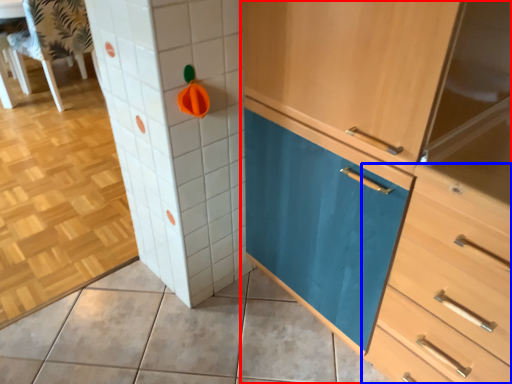
Question: Which point is further to the camera, cabinetry (highlighted by a red box) or chest of drawers (highlighted by a blue box)?

Choices:
 (A) cabinetry
 (B) chest of drawers

Answer: (A)